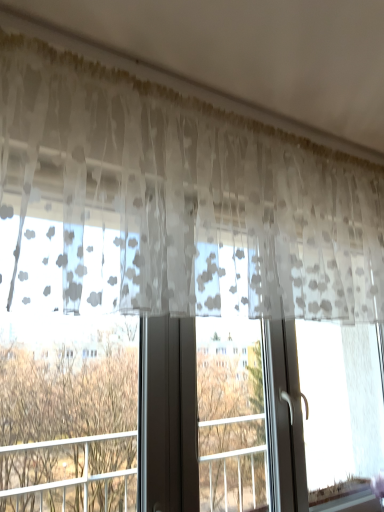
Question: From the image's perspective, is transparent floral-patterned curtain at upper center located above or below brown leafy tree at left?

Choices:
 (A) below
 (B) above

Answer: (B)

Question: From a real-world perspective, relative to brown leafy tree at left, is transparent floral-patterned curtain at upper center vertically above or below?

Choices:
 (A) below
 (B) above

Answer: (B)

Question: In terms of size, does transparent floral-patterned curtain at upper center appear bigger or smaller than brown leafy tree at left?

Choices:
 (A) small
 (B) big

Answer: (B)

Question: Is brown leafy tree at left wider or thinner than transparent floral-patterned curtain at upper center?

Choices:
 (A) wide
 (B) thin

Answer: (B)

Question: Does point (99, 468) appear closer or farther from the camera than point (59, 91)?

Choices:
 (A) farther
 (B) closer

Answer: (A)

Question: Considering the positions of brown leafy tree at left and transparent floral-patterned curtain at upper center in the image, is brown leafy tree at left taller or shorter than transparent floral-patterned curtain at upper center?

Choices:
 (A) short
 (B) tall

Answer: (A)

Question: From a real-world perspective, relative to transparent floral-patterned curtain at upper center, is brown leafy tree at left vertically above or below?

Choices:
 (A) below
 (B) above

Answer: (A)